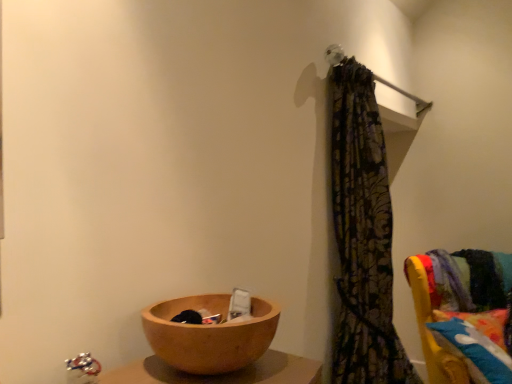
Question: Is the depth of wooden bowl at lower left less than that of patterned fabric curtain at upper right?

Choices:
 (A) no
 (B) yes

Answer: (B)

Question: Can you see wooden bowl at lower left touching patterned fabric curtain at upper right?

Choices:
 (A) no
 (B) yes

Answer: (A)

Question: Is wooden bowl at lower left positioned behind patterned fabric curtain at upper right?

Choices:
 (A) no
 (B) yes

Answer: (A)

Question: Could you tell me if wooden bowl at lower left is facing patterned fabric curtain at upper right?

Choices:
 (A) no
 (B) yes

Answer: (A)

Question: Are wooden bowl at lower left and patterned fabric curtain at upper right far apart?

Choices:
 (A) yes
 (B) no

Answer: (A)

Question: Do you think velvet yellow chair at right is within fluffy multicolored pillow at right, or outside of it?

Choices:
 (A) inside
 (B) outside

Answer: (B)

Question: In terms of width, does velvet yellow chair at right look wider or thinner when compared to fluffy multicolored pillow at right?

Choices:
 (A) wide
 (B) thin

Answer: (A)

Question: Considering the positions of point (415, 258) and point (451, 350), is point (415, 258) closer or farther from the camera than point (451, 350)?

Choices:
 (A) farther
 (B) closer

Answer: (A)

Question: Considering the relative positions of velvet yellow chair at right and fluffy multicolored pillow at right in the image provided, is velvet yellow chair at right to the left or to the right of fluffy multicolored pillow at right?

Choices:
 (A) left
 (B) right

Answer: (A)

Question: From a real-world perspective, is velvet yellow chair at right positioned above or below patterned fabric curtain at upper right?

Choices:
 (A) below
 (B) above

Answer: (A)

Question: Is velvet yellow chair at right situated inside patterned fabric curtain at upper right or outside?

Choices:
 (A) inside
 (B) outside

Answer: (B)

Question: Looking at the image, does velvet yellow chair at right seem bigger or smaller compared to patterned fabric curtain at upper right?

Choices:
 (A) big
 (B) small

Answer: (A)

Question: Considering their positions, is velvet yellow chair at right located in front of or behind patterned fabric curtain at upper right?

Choices:
 (A) behind
 (B) front

Answer: (A)

Question: Considering the positions of point (348, 74) and point (446, 382), is point (348, 74) closer or farther from the camera than point (446, 382)?

Choices:
 (A) closer
 (B) farther

Answer: (A)

Question: Is patterned fabric curtain at upper right inside the boundaries of velvet yellow chair at right, or outside?

Choices:
 (A) inside
 (B) outside

Answer: (B)